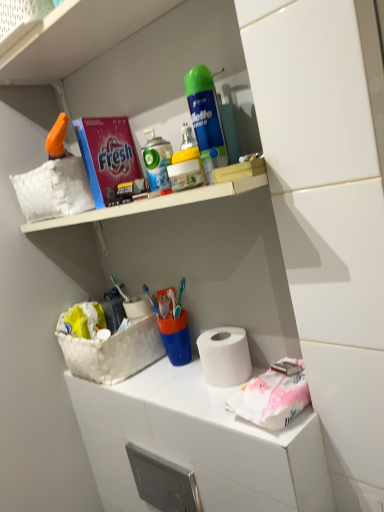
Question: Is yellow matte spray can at upper center, which appears as the second cleaning product when viewed from the top, at the back of white plastic spray can at upper center?

Choices:
 (A) yes
 (B) no

Answer: (B)

Question: Could you tell me if white plastic spray can at upper center is facing yellow matte spray can at upper center, the 1th cleaning product when ordered from bottom to top?

Choices:
 (A) no
 (B) yes

Answer: (A)

Question: Is white plastic spray can at upper center thinner than yellow matte spray can at upper center, which appears as the second cleaning product when viewed from the top?

Choices:
 (A) no
 (B) yes

Answer: (B)

Question: Is the position of white plastic spray can at upper center less distant than that of yellow matte spray can at upper center, the 1th cleaning product when ordered from bottom to top?

Choices:
 (A) yes
 (B) no

Answer: (B)

Question: Does white plastic spray can at upper center have a greater width compared to yellow matte spray can at upper center, the 1th cleaning product when ordered from bottom to top?

Choices:
 (A) yes
 (B) no

Answer: (B)

Question: Considering the positions of white woven basket at lower left and white plastic spray can at upper center in the image, is white woven basket at lower left bigger or smaller than white plastic spray can at upper center?

Choices:
 (A) small
 (B) big

Answer: (B)

Question: From a real-world perspective, is white woven basket at lower left physically located above or below white plastic spray can at upper center?

Choices:
 (A) below
 (B) above

Answer: (A)

Question: From the image's perspective, is white woven basket at lower left located above or below white plastic spray can at upper center?

Choices:
 (A) above
 (B) below

Answer: (B)

Question: Is white woven basket at lower left to the left or to the right of white plastic spray can at upper center in the image?

Choices:
 (A) right
 (B) left

Answer: (B)

Question: Considering their positions, is pink paper at lower right located in front of or behind white plastic spray can at upper center?

Choices:
 (A) front
 (B) behind

Answer: (A)

Question: Considering the positions of pink paper at lower right and white plastic spray can at upper center in the image, is pink paper at lower right taller or shorter than white plastic spray can at upper center?

Choices:
 (A) tall
 (B) short

Answer: (B)

Question: In terms of width, does pink paper at lower right look wider or thinner when compared to white plastic spray can at upper center?

Choices:
 (A) thin
 (B) wide

Answer: (B)

Question: Which is correct: pink paper at lower right is inside white plastic spray can at upper center, or outside of it?

Choices:
 (A) outside
 (B) inside

Answer: (A)

Question: From a real-world perspective, relative to pink paper at lower right, is white plastic spray can at upper center vertically above or below?

Choices:
 (A) above
 (B) below

Answer: (A)

Question: Is white plastic spray can at upper center inside the boundaries of pink paper at lower right, or outside?

Choices:
 (A) outside
 (B) inside

Answer: (A)